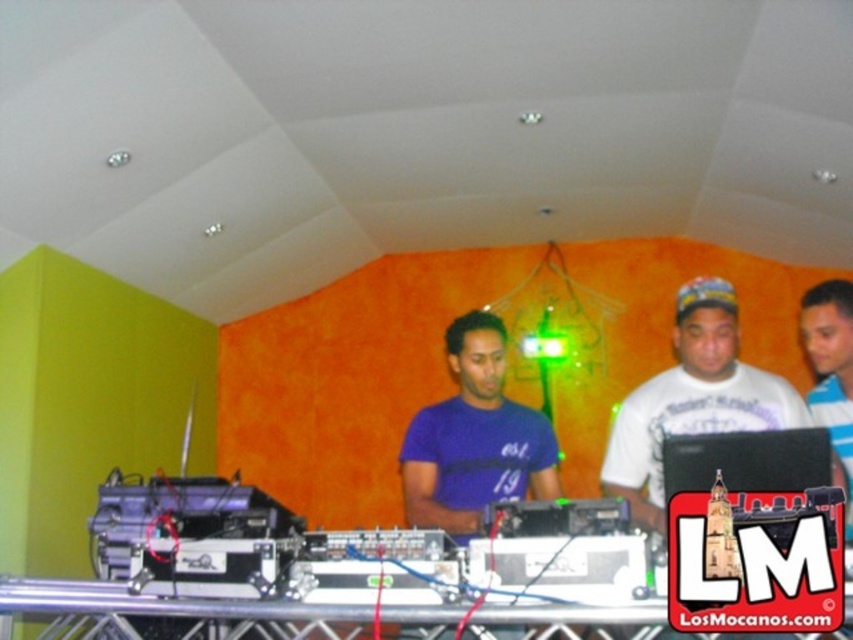
Which is above, black plastic laptop at center or white striped shirt at center?

white striped shirt at center is above.

Which is in front, point (733, 449) or point (834, 324)?

Positioned in front is point (733, 449).

Describe the element at coordinates (747, 460) in the screenshot. I see `black plastic laptop at center` at that location.

Where is `black plastic laptop at center`? Image resolution: width=853 pixels, height=640 pixels. black plastic laptop at center is located at coordinates pos(747,460).

Measure the distance between point (807, 424) and camera.

Point (807, 424) is 7.77 feet from camera.

Is white cotton shirt at center further to the viewer compared to white striped shirt at center?

No.

I want to click on white cotton shirt at center, so click(x=692, y=397).

Where is `white cotton shirt at center`? The height and width of the screenshot is (640, 853). white cotton shirt at center is located at coordinates (692, 397).

Which of these two, white cotton shirt at center or black plastic laptop at center, stands shorter?

black plastic laptop at center

Does white cotton shirt at center come behind black plastic laptop at center?

Yes, it is.

This screenshot has width=853, height=640. Find the location of `white cotton shirt at center`. white cotton shirt at center is located at coordinates (692, 397).

What are the coordinates of `white cotton shirt at center` in the screenshot? It's located at (692, 397).